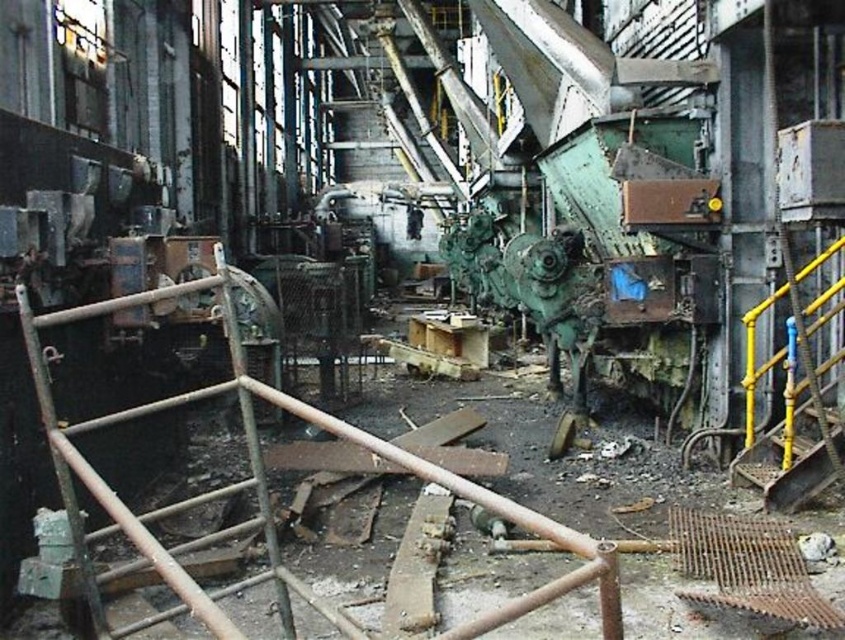
Is rusty metal ladder at left thinner than yellow metal ladder at right?

In fact, rusty metal ladder at left might be wider than yellow metal ladder at right.

Does rusty metal ladder at left appear on the right side of yellow metal ladder at right?

In fact, rusty metal ladder at left is to the left of yellow metal ladder at right.

Who is more distant from viewer, (82, 468) or (780, 470)?

Positioned behind is point (780, 470).

This screenshot has height=640, width=845. I want to click on rusty metal ladder at left, so click(x=166, y=506).